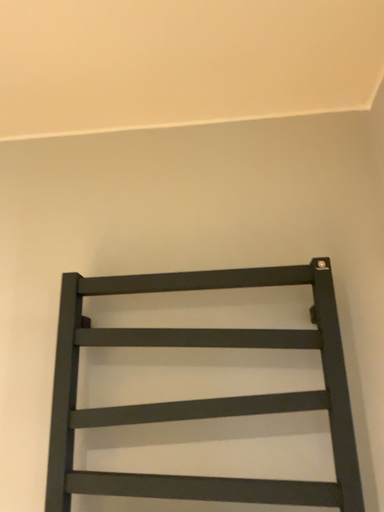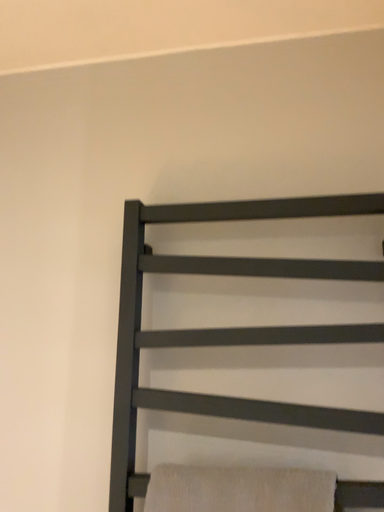
Question: How did the camera likely rotate when shooting the video?

Choices:
 (A) rotated left
 (B) rotated right

Answer: (A)